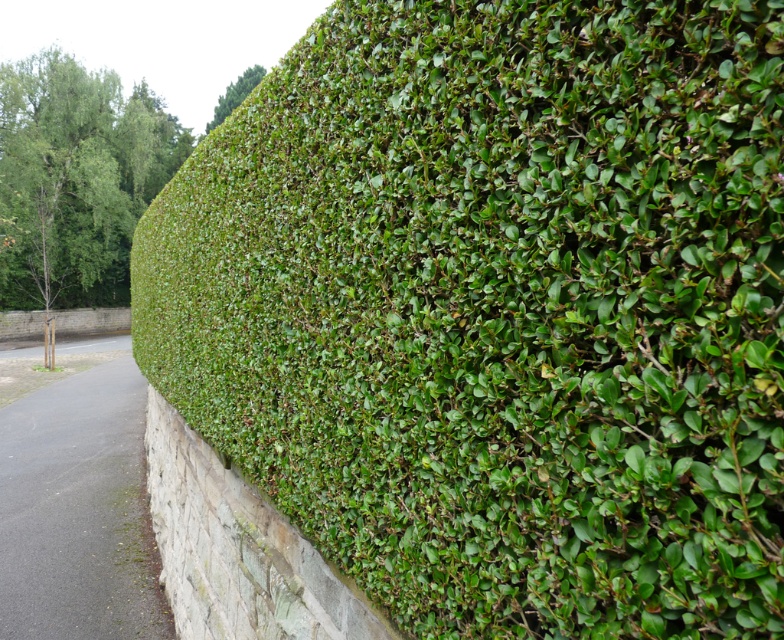
Question: Can you confirm if green leafy tree at upper left is positioned below green leafy hedge at upper left?

Choices:
 (A) yes
 (B) no

Answer: (A)

Question: Among these objects, which one is nearest to the camera?

Choices:
 (A) green leafy tree at upper left
 (B) green leafy hedge at upper left

Answer: (A)

Question: Where is green leafy tree at upper left located in relation to green leafy hedge at upper left in the image?

Choices:
 (A) below
 (B) above

Answer: (A)

Question: Among these objects, which one is farthest from the camera?

Choices:
 (A) green leafy tree at upper left
 (B) green leafy hedge at upper left

Answer: (B)

Question: Which object appears farthest from the camera in this image?

Choices:
 (A) green leafy hedge at upper left
 (B) green leafy tree at upper left

Answer: (A)

Question: Does green leafy tree at upper left appear on the left side of green leafy hedge at upper left?

Choices:
 (A) no
 (B) yes

Answer: (B)